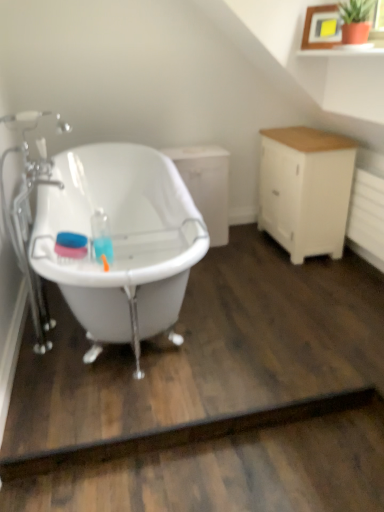
Describe the element at coordinates (183, 434) in the screenshot. I see `dark brown wood at lower center` at that location.

In order to face white glossy bathtub at left, should I rotate leftwards or rightwards?

To face it directly, rotate left by 9.751 degrees.

Identify the location of dark brown wood at lower center. The height and width of the screenshot is (512, 384). (183, 434).

Between dark brown wood at lower center and white matte cabinet at center, which ranks as the 1th cabinetry in left-to-right order, which one appears on the left side from the viewer's perspective?

white matte cabinet at center, which ranks as the 1th cabinetry in left-to-right order, is more to the left.

Is dark brown wood at lower center shorter than white matte cabinet at center, which ranks as the 1th cabinetry in left-to-right order?

Yes, dark brown wood at lower center is shorter than white matte cabinet at center, which ranks as the 1th cabinetry in left-to-right order.

Does dark brown wood at lower center have a lesser width compared to white matte cabinet at center, positioned as the 2th cabinetry in right-to-left order?

Correct, the width of dark brown wood at lower center is less than that of white matte cabinet at center, positioned as the 2th cabinetry in right-to-left order.

Could you tell me if dark brown wood at lower center is turned towards white matte cabinet at center, positioned as the 2th cabinetry in right-to-left order?

No, dark brown wood at lower center is not turned towards white matte cabinet at center, positioned as the 2th cabinetry in right-to-left order.

From the image's perspective, is dark brown wood at lower center below white wood cabinet at right, marked as the 2th cabinetry in a left-to-right arrangement?

Yes, from the image's perspective, dark brown wood at lower center is beneath white wood cabinet at right, marked as the 2th cabinetry in a left-to-right arrangement.

Looking at this image, from a real-world perspective, is dark brown wood at lower center above or below white wood cabinet at right, the first cabinetry viewed from the right?

dark brown wood at lower center is situated lower than white wood cabinet at right, the first cabinetry viewed from the right, in the real world.

Is dark brown wood at lower center positioned far away from white wood cabinet at right, marked as the 2th cabinetry in a left-to-right arrangement?

Absolutely, dark brown wood at lower center is distant from white wood cabinet at right, marked as the 2th cabinetry in a left-to-right arrangement.

Is white matte cabinet at center, which ranks as the 1th cabinetry in left-to-right order, oriented towards dark brown wood at lower center?

A: Yes, white matte cabinet at center, which ranks as the 1th cabinetry in left-to-right order, is facing dark brown wood at lower center.

From a real-world perspective, is white matte cabinet at center, positioned as the 2th cabinetry in right-to-left order, located higher than dark brown wood at lower center?

Yes.

Based on the photo, which of these two, white matte cabinet at center, positioned as the 2th cabinetry in right-to-left order, or dark brown wood at lower center, is bigger?

white matte cabinet at center, positioned as the 2th cabinetry in right-to-left order, is bigger.

In the scene shown: From a real-world perspective, which object stands above the other?

white wood cabinet at right, marked as the 2th cabinetry in a left-to-right arrangement, is physically above.

Is white wood cabinet at right, marked as the 2th cabinetry in a left-to-right arrangement, aimed at white matte cabinet at center, which ranks as the 1th cabinetry in left-to-right order?

Yes.

Which is in front, point (214, 178) or point (269, 217)?

The point (214, 178) is closer to the camera.

Can you confirm if white matte cabinet at center, positioned as the 2th cabinetry in right-to-left order, is positioned to the right of white wood cabinet at right, marked as the 2th cabinetry in a left-to-right arrangement?

Incorrect, white matte cabinet at center, positioned as the 2th cabinetry in right-to-left order, is not on the right side of white wood cabinet at right, marked as the 2th cabinetry in a left-to-right arrangement.

Is white matte cabinet at center, which ranks as the 1th cabinetry in left-to-right order, oriented away from white wood cabinet at right, marked as the 2th cabinetry in a left-to-right arrangement?

No, white matte cabinet at center, which ranks as the 1th cabinetry in left-to-right order, is not facing the opposite direction of white wood cabinet at right, marked as the 2th cabinetry in a left-to-right arrangement.

Which of these two, white matte cabinet at center, which ranks as the 1th cabinetry in left-to-right order, or white wood cabinet at right, the first cabinetry viewed from the right, is wider?

Wider between the two is white matte cabinet at center, which ranks as the 1th cabinetry in left-to-right order.

Considering the relative sizes of white glossy bathtub at left and white wood cabinet at right, the first cabinetry viewed from the right, in the image provided, is white glossy bathtub at left shorter than white wood cabinet at right, the first cabinetry viewed from the right,?

Incorrect, the height of white glossy bathtub at left does not fall short of that of white wood cabinet at right, the first cabinetry viewed from the right.

Is white glossy bathtub at left with white wood cabinet at right, the first cabinetry viewed from the right?

white glossy bathtub at left and white wood cabinet at right, the first cabinetry viewed from the right, are not in contact.

Is white wood cabinet at right, the first cabinetry viewed from the right, completely or partially inside white glossy bathtub at left?

No, white wood cabinet at right, the first cabinetry viewed from the right, is not surrounded by white glossy bathtub at left.

Which is more to the left, white glossy bathtub at left or white wood cabinet at right, marked as the 2th cabinetry in a left-to-right arrangement?

From the viewer's perspective, white glossy bathtub at left appears more on the left side.

You are a GUI agent. You are given a task and a screenshot of the screen. Output one action in this format:
    pyautogui.click(x=<x>, y=<y>)
    Task: Click on the plank that is under the white glossy bathtub at left (from a real-world perspective)
    This screenshot has height=512, width=384.
    Given the screenshot: What is the action you would take?
    pyautogui.click(x=183, y=434)

How different are the orientations of white glossy bathtub at left and dark brown wood at lower center in degrees?

white glossy bathtub at left and dark brown wood at lower center are facing 89.7 degrees away from each other.

Considering the points (98, 287) and (100, 442), which point is in front, point (98, 287) or point (100, 442)?

Positioned in front is point (98, 287).

Is white glossy bathtub at left at the left side of dark brown wood at lower center?

Yes.

Locate an element on the screen. Image resolution: width=384 pixels, height=512 pixels. plank below the white matte cabinet at center, which ranks as the 1th cabinetry in left-to-right order (from a real-world perspective) is located at coordinates (183, 434).

Find the location of a particular element. plank lying below the white wood cabinet at right, the first cabinetry viewed from the right (from the image's perspective) is located at coordinates (183, 434).

Considering their positions, is white glossy bathtub at left positioned further to white wood cabinet at right, the first cabinetry viewed from the right, than white matte cabinet at center, which ranks as the 1th cabinetry in left-to-right order?

white glossy bathtub at left is positioned further to the anchor white wood cabinet at right, the first cabinetry viewed from the right.

Which object lies nearer to the anchor point white matte cabinet at center, which ranks as the 1th cabinetry in left-to-right order, dark brown wood at lower center or white glossy bathtub at left?

white glossy bathtub at left lies closer to white matte cabinet at center, which ranks as the 1th cabinetry in left-to-right order, than the other object.

When comparing their distances from white matte cabinet at center, positioned as the 2th cabinetry in right-to-left order, does white glossy bathtub at left or white wood cabinet at right, marked as the 2th cabinetry in a left-to-right arrangement, seem closer?

white wood cabinet at right, marked as the 2th cabinetry in a left-to-right arrangement, is closer to white matte cabinet at center, positioned as the 2th cabinetry in right-to-left order.

Considering their positions, is white wood cabinet at right, the first cabinetry viewed from the right, positioned closer to dark brown wood at lower center than white matte cabinet at center, which ranks as the 1th cabinetry in left-to-right order?

Among the two, white wood cabinet at right, the first cabinetry viewed from the right, is located nearer to dark brown wood at lower center.

Looking at the image, which one is located further to white wood cabinet at right, marked as the 2th cabinetry in a left-to-right arrangement, dark brown wood at lower center or white matte cabinet at center, positioned as the 2th cabinetry in right-to-left order?

dark brown wood at lower center is positioned further to the anchor white wood cabinet at right, marked as the 2th cabinetry in a left-to-right arrangement.

Estimate the real-world distances between objects in this image. Which object is further from white wood cabinet at right, the first cabinetry viewed from the right, white matte cabinet at center, which ranks as the 1th cabinetry in left-to-right order, or dark brown wood at lower center?

dark brown wood at lower center is further to white wood cabinet at right, the first cabinetry viewed from the right.

Which object lies nearer to the anchor point dark brown wood at lower center, white glossy bathtub at left or white matte cabinet at center, which ranks as the 1th cabinetry in left-to-right order?

white glossy bathtub at left is closer to dark brown wood at lower center.

Consider the image. Looking at the image, which one is located further to white wood cabinet at right, marked as the 2th cabinetry in a left-to-right arrangement, white matte cabinet at center, positioned as the 2th cabinetry in right-to-left order, or white glossy bathtub at left?

white glossy bathtub at left.

Locate an element on the screen. The height and width of the screenshot is (512, 384). plank positioned between white glossy bathtub at left and white matte cabinet at center, positioned as the 2th cabinetry in right-to-left order, from near to far is located at coordinates (183, 434).

Find the location of a particular element. The width and height of the screenshot is (384, 512). plank located between white glossy bathtub at left and white wood cabinet at right, marked as the 2th cabinetry in a left-to-right arrangement, in the depth direction is located at coordinates (183, 434).

Locate an element on the screen. cabinetry between white glossy bathtub at left and white matte cabinet at center, which ranks as the 1th cabinetry in left-to-right order, along the z-axis is located at coordinates (305, 190).

This screenshot has width=384, height=512. I want to click on cabinetry between dark brown wood at lower center and white matte cabinet at center, which ranks as the 1th cabinetry in left-to-right order, in the front-back direction, so coord(305,190).